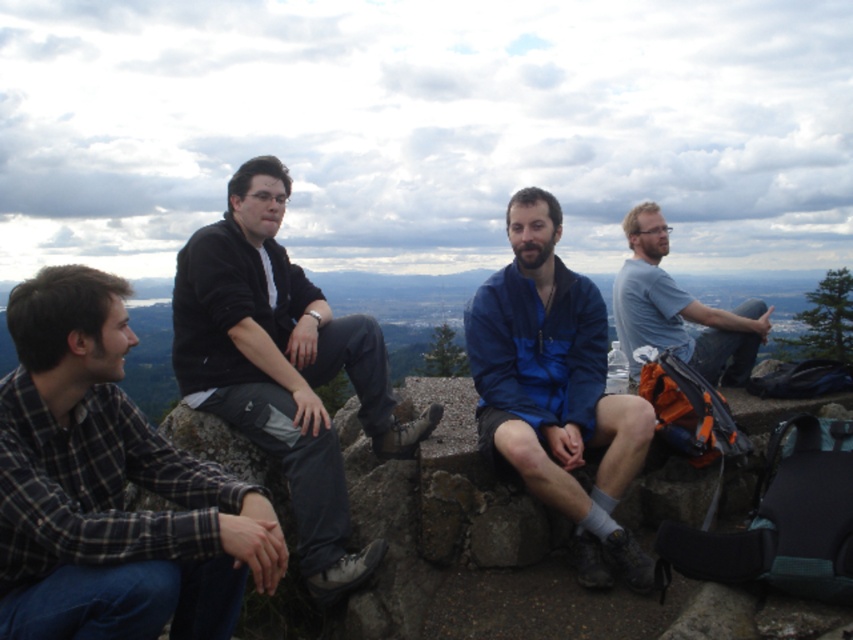
Consider the image. You are standing at the center of the rocky outcrop and want to know the position of the dark gray fabric pants at center relative to the other objects in the scene. Can you determine if it is positioned to the left or right of the group?

The dark gray fabric pants at center is located at point (283, 368), which places it towards the right side of the group since the coordinates suggest it is positioned more to the right within the scene.